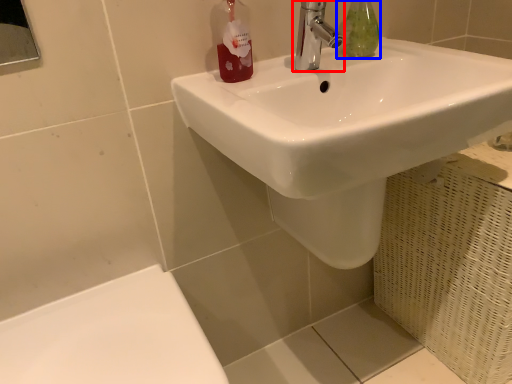
Question: Which point is closer to the camera, tap (highlighted by a red box) or mouthwash (highlighted by a blue box)?

Choices:
 (A) tap
 (B) mouthwash

Answer: (A)